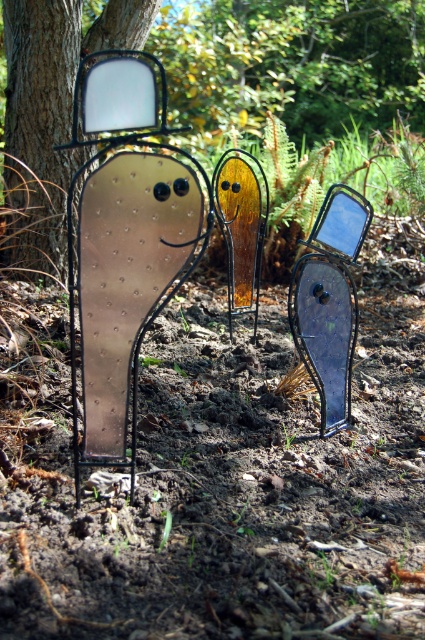
Question: Which of the following is the closest to the observer?

Choices:
 (A) (5, 10)
 (B) (2, 42)

Answer: (A)

Question: Which of the following is the farthest from the observer?

Choices:
 (A) (45, 42)
 (B) (8, 109)

Answer: (B)

Question: Does brushed metal tree at upper center have a greater width compared to brushed metal mirror at left?

Choices:
 (A) no
 (B) yes

Answer: (B)

Question: Which point is farther to the camera?

Choices:
 (A) brushed metal mirror at left
 (B) brushed metal tree at upper center

Answer: (B)

Question: Is brushed metal tree at upper center positioned behind brushed metal mirror at left?

Choices:
 (A) yes
 (B) no

Answer: (A)

Question: Can you confirm if brushed metal tree at upper center is bigger than brushed metal mirror at left?

Choices:
 (A) no
 (B) yes

Answer: (B)